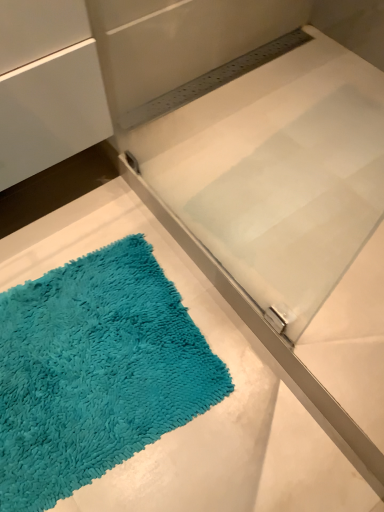
At what (x,y) coordinates should I click in order to perform the action: click on vacant area that is situated to the right of turquoise shaggy bath mat at lower left. Please return your answer as a coordinate pair (x, y). Looking at the image, I should click on (246, 403).